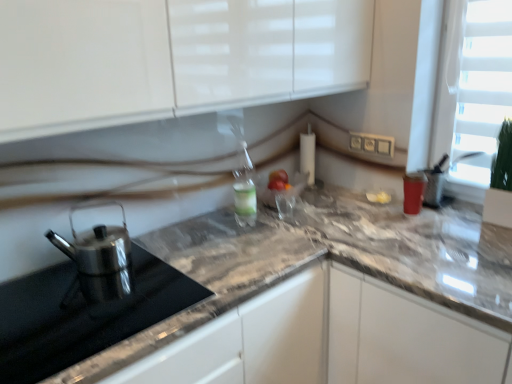
Question: Is marble countertop at right taller or shorter than polished stainless steel kettle at left?

Choices:
 (A) tall
 (B) short

Answer: (A)

Question: From a real-world perspective, is marble countertop at right physically located above or below polished stainless steel kettle at left?

Choices:
 (A) below
 (B) above

Answer: (A)

Question: Which object is positioned closest to the polished stainless steel kettle at left?

Choices:
 (A) polished stainless steel kettle at left
 (B) marble countertop at right

Answer: (A)

Question: Estimate the real-world distances between objects in this image. Which object is farther from the marble countertop at right?

Choices:
 (A) polished stainless steel kettle at left
 (B) polished stainless steel kettle at left

Answer: (B)